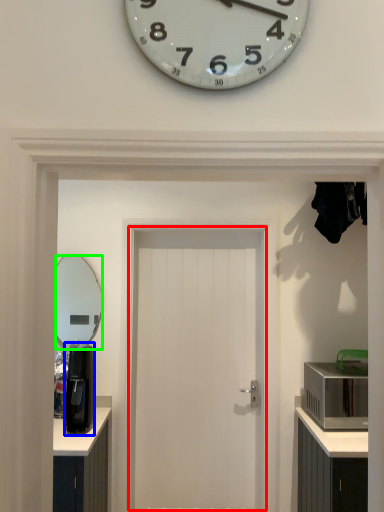
Question: Estimate the real-world distances between objects in this image. Which object is closer to door (highlighted by a red box), coffee machine (highlighted by a blue box) or mirror (highlighted by a green box)?

Choices:
 (A) coffee machine
 (B) mirror

Answer: (A)